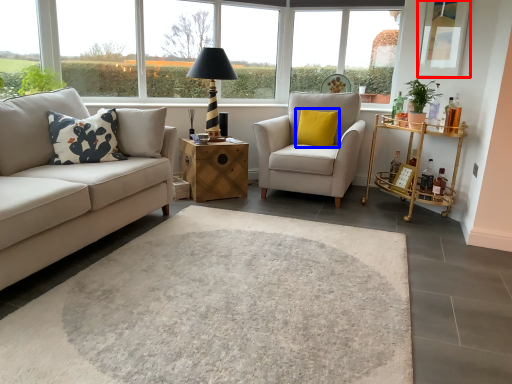
Question: Among these objects, which one is farthest to the camera, window screen (highlighted by a red box) or pillow (highlighted by a blue box)?

Choices:
 (A) window screen
 (B) pillow

Answer: (B)